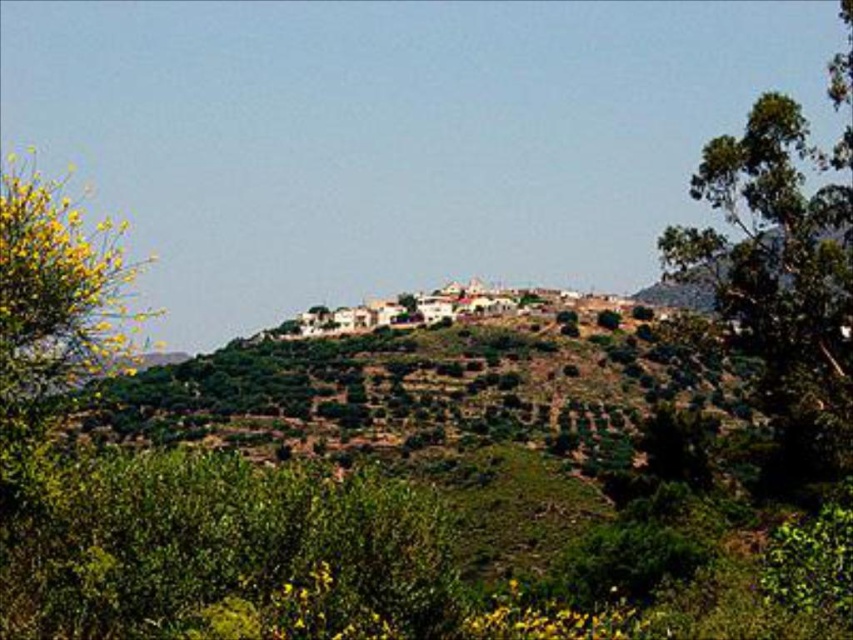
Who is higher up, green leafy tree at right or yellow-green leafy bush at left?

Positioned higher is yellow-green leafy bush at left.

Image resolution: width=853 pixels, height=640 pixels. Describe the element at coordinates (779, 278) in the screenshot. I see `green leafy tree at right` at that location.

The image size is (853, 640). Find the location of `green leafy tree at right`. green leafy tree at right is located at coordinates (779, 278).

This screenshot has height=640, width=853. Identify the location of green leafy tree at right. (779, 278).